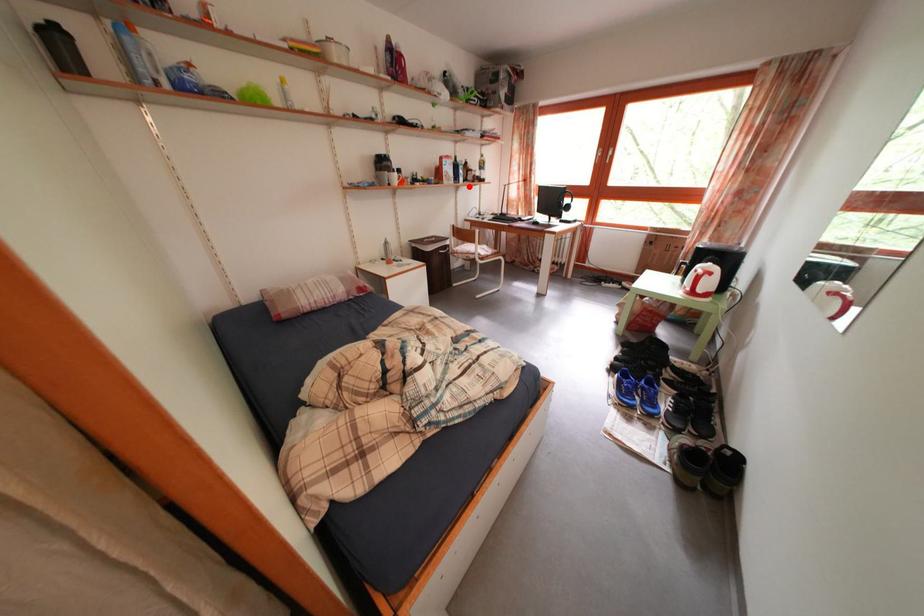
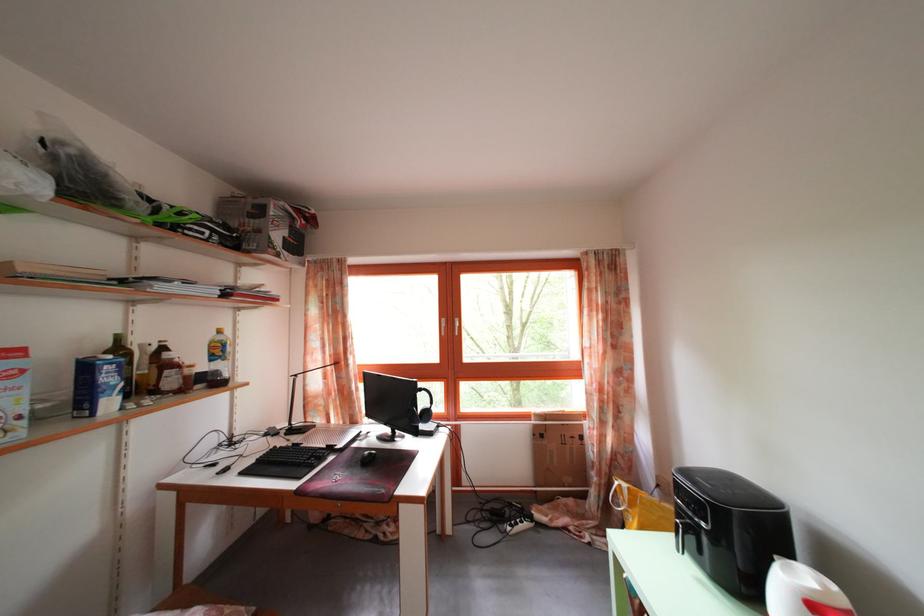
Locate, in the second image, the point that corresponds to the highlighted location in the first image.

(117, 410)